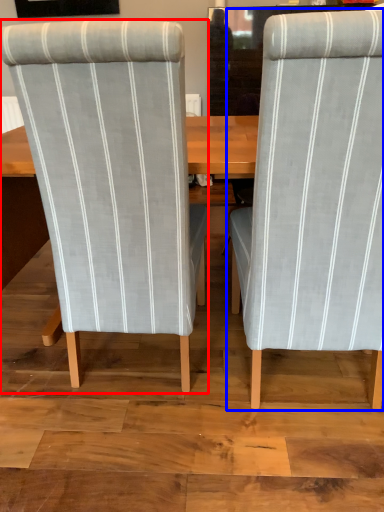
Question: Which object appears closest to the camera in this image, chair (highlighted by a red box) or chair (highlighted by a blue box)?

Choices:
 (A) chair
 (B) chair

Answer: (B)